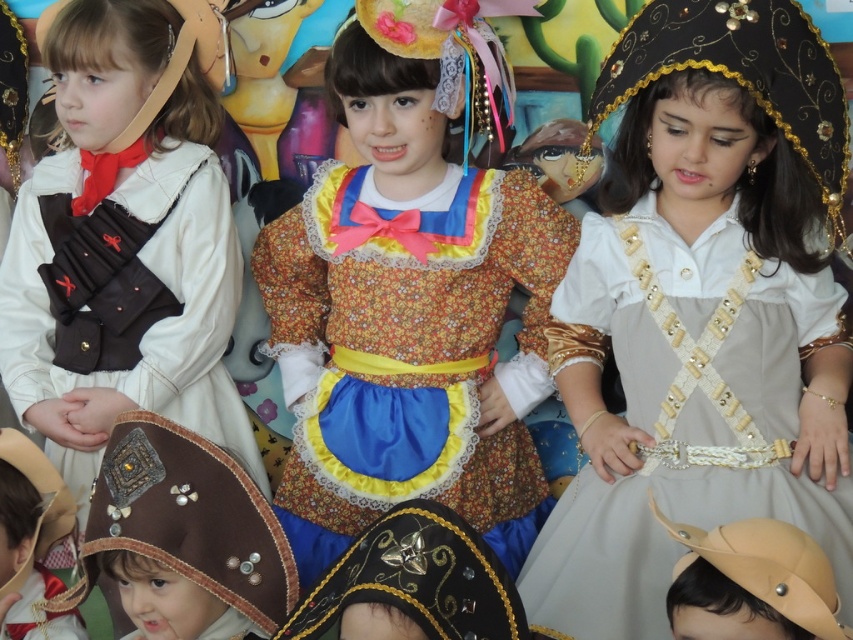
You are a photographer setting up for a cultural performance. You need to ensure that the light beige satin dress at center and the black sequined headdress at upper right are both visible in the frame. Based on their positions, which object is wider and might require more space in the photo?

The light beige satin dress at center might be wider than the black sequined headdress at upper right, so it requires more space in the photo to ensure visibility.

You are a costume designer preparing for a performance. You need to ensure that all costumes fit properly. Looking at the image, which object, the light beige satin dress at center or the shiny brown leather belt at lower left, is larger in size?

The light beige satin dress at center is bigger than the shiny brown leather belt at lower left.